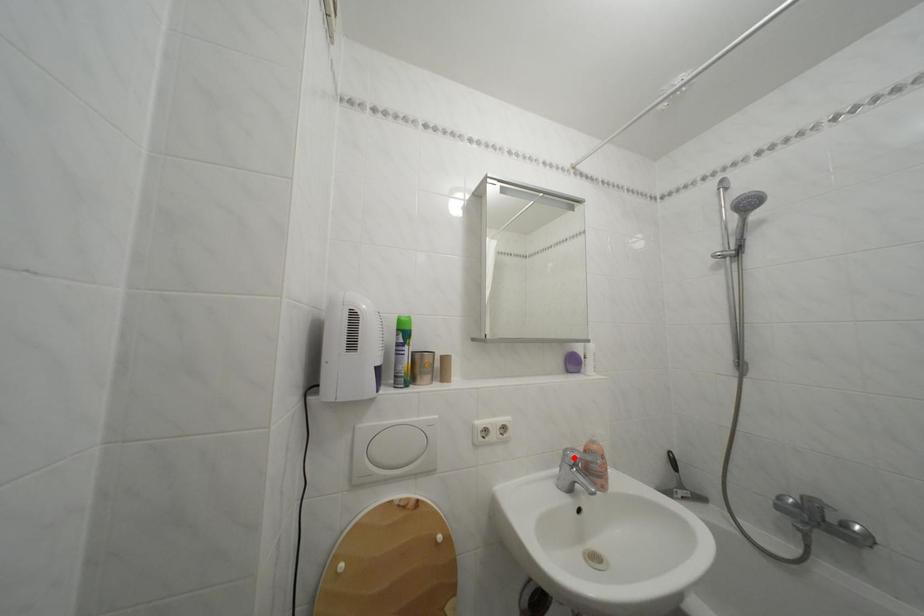
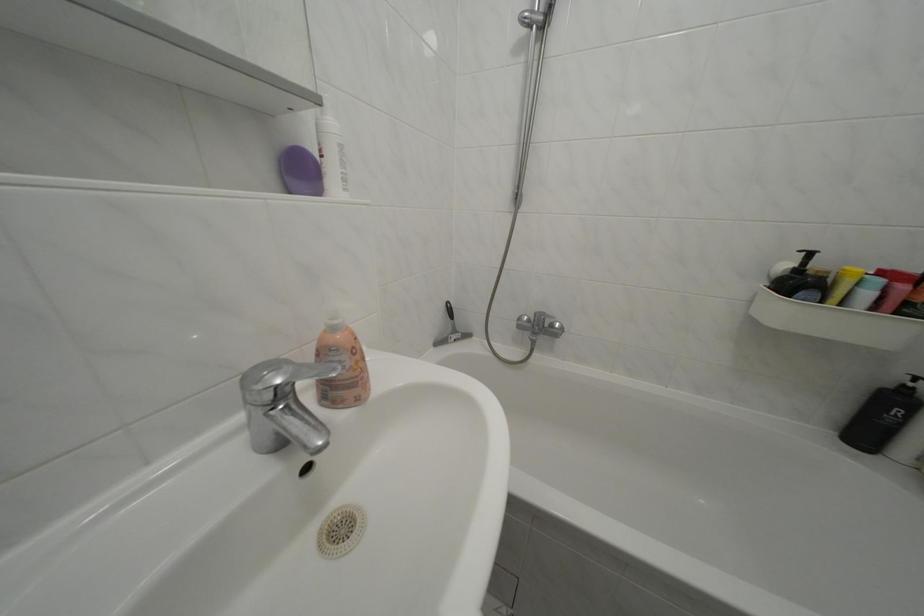
Find the pixel in the second image that matches the highlighted location in the first image.

(252, 384)